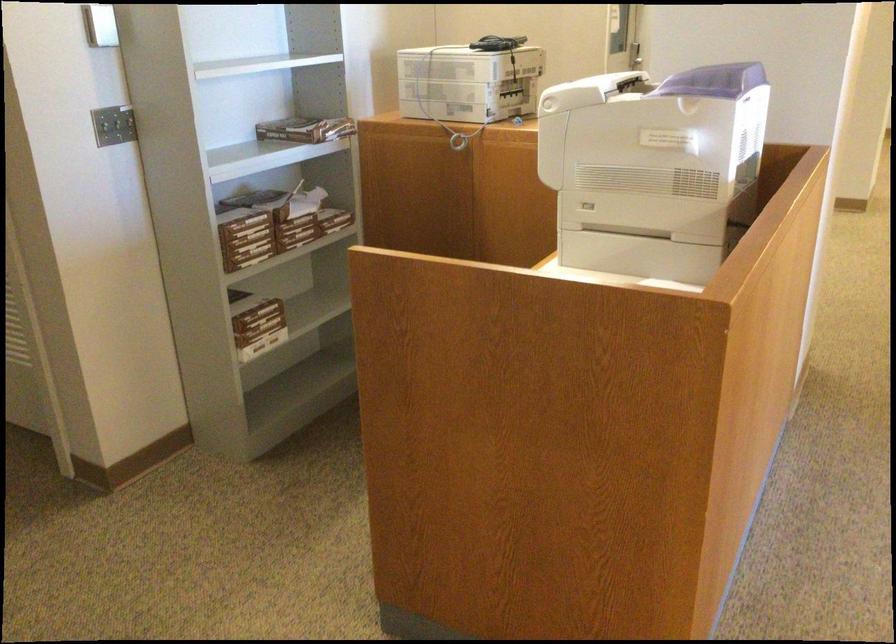
The width and height of the screenshot is (896, 644). Describe the element at coordinates (114, 125) in the screenshot. I see `the light switch` at that location.